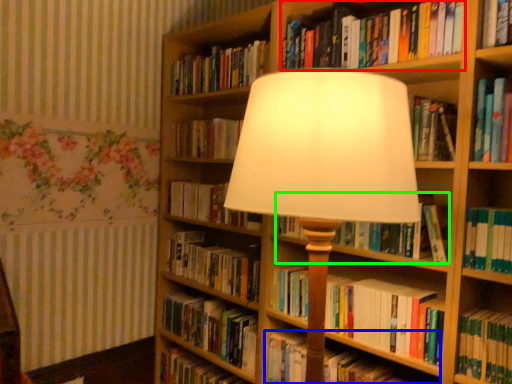
Question: Which object is positioned farthest from book (highlighted by a red box)? Select from book (highlighted by a blue box) and book (highlighted by a green box).

Choices:
 (A) book
 (B) book

Answer: (A)